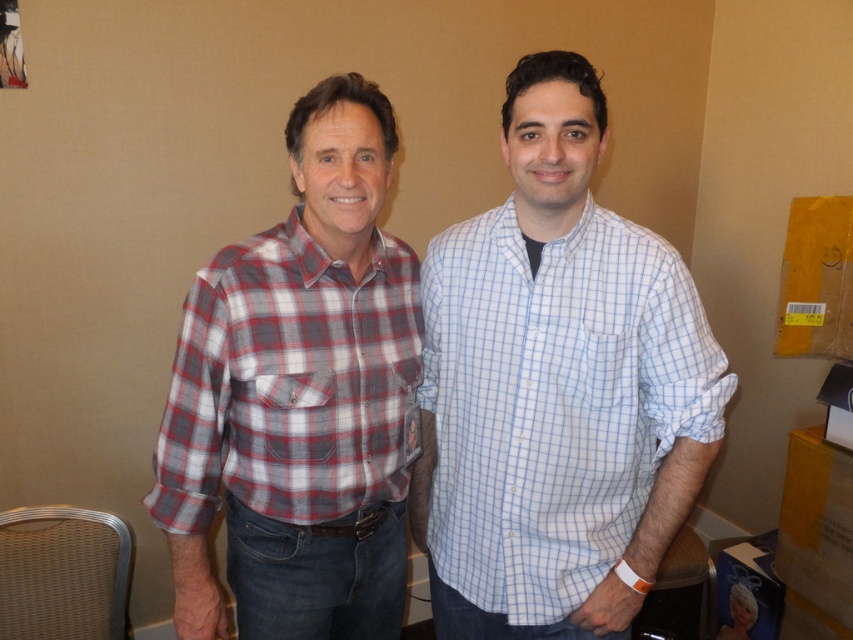
Question: Is white checkered shirt at center above red-gray plaid shirt at left?

Choices:
 (A) no
 (B) yes

Answer: (A)

Question: Can you confirm if white checkered shirt at center is wider than red-gray plaid shirt at left?

Choices:
 (A) yes
 (B) no

Answer: (A)

Question: Which of the following is the farthest from the observer?

Choices:
 (A) white checkered shirt at center
 (B) red-gray plaid shirt at left

Answer: (B)

Question: Is white checkered shirt at center thinner than red-gray plaid shirt at left?

Choices:
 (A) no
 (B) yes

Answer: (A)